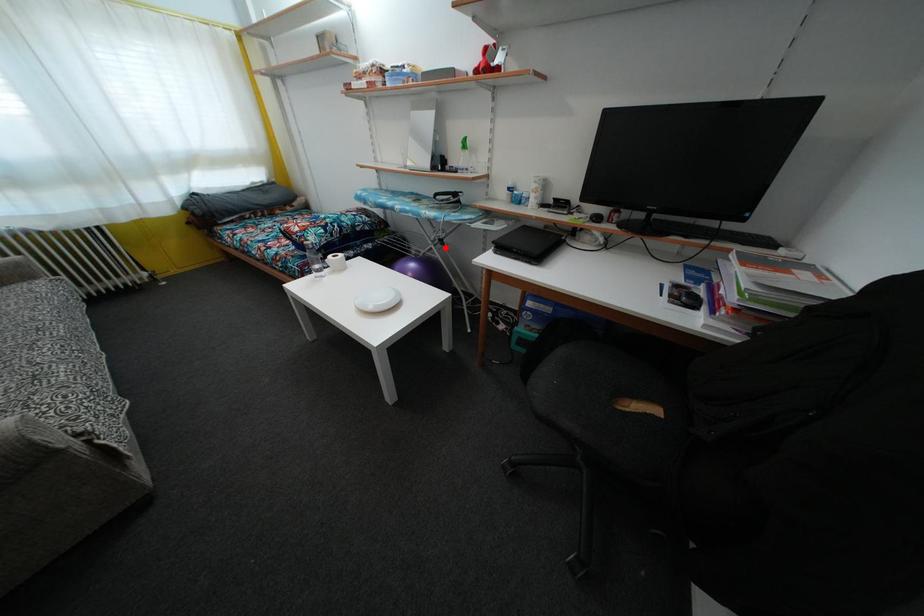
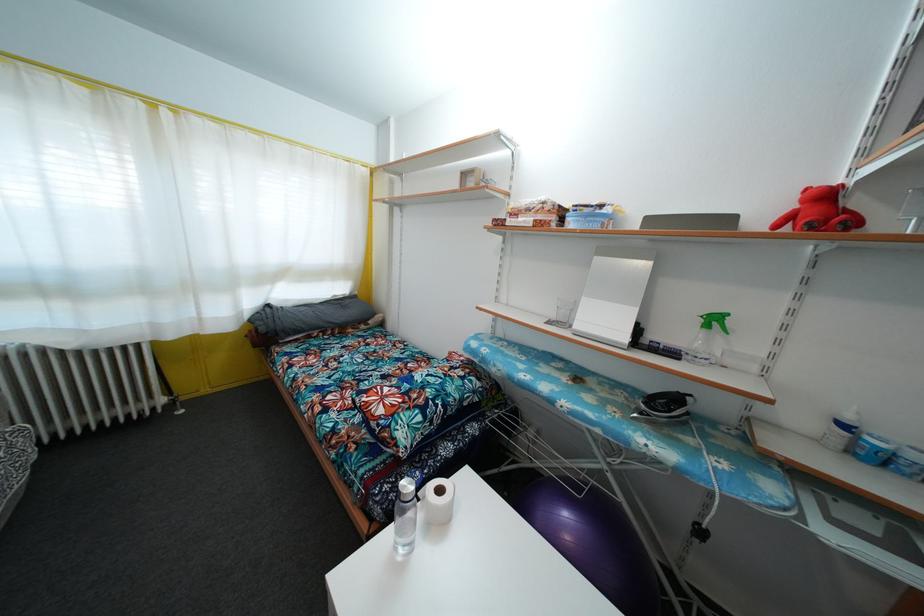
Locate, in the second image, the point that corresponds to the highlighted location in the first image.

(704, 540)